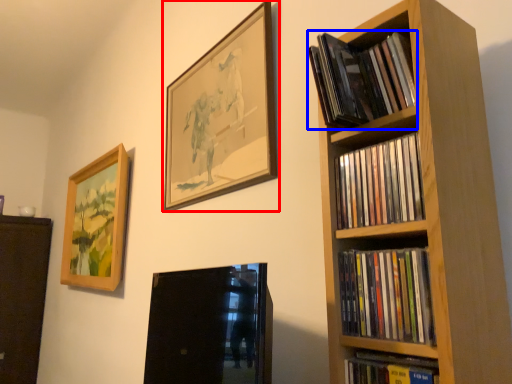
Question: Which object appears closest to the camera in this image, picture frame (highlighted by a red box) or book (highlighted by a blue box)?

Choices:
 (A) picture frame
 (B) book

Answer: (B)